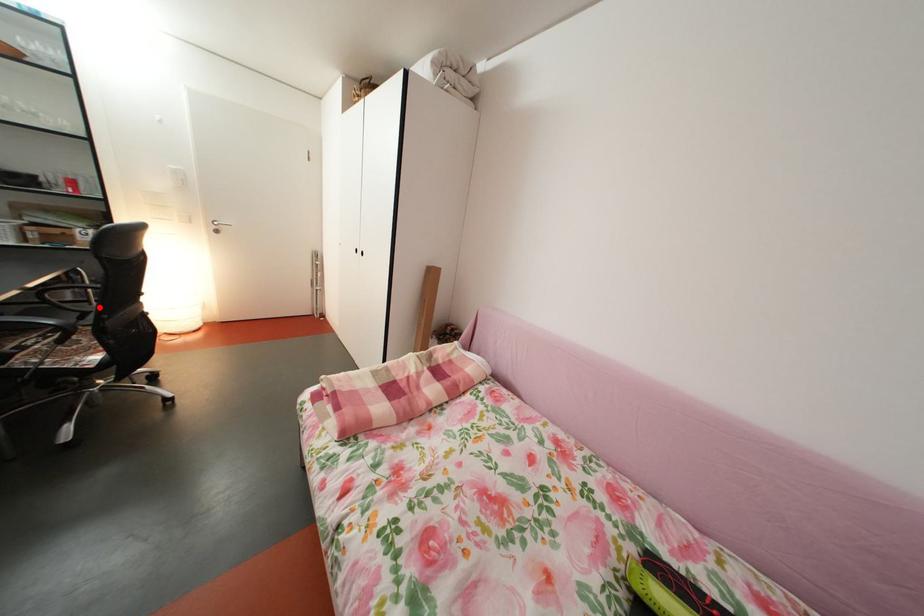
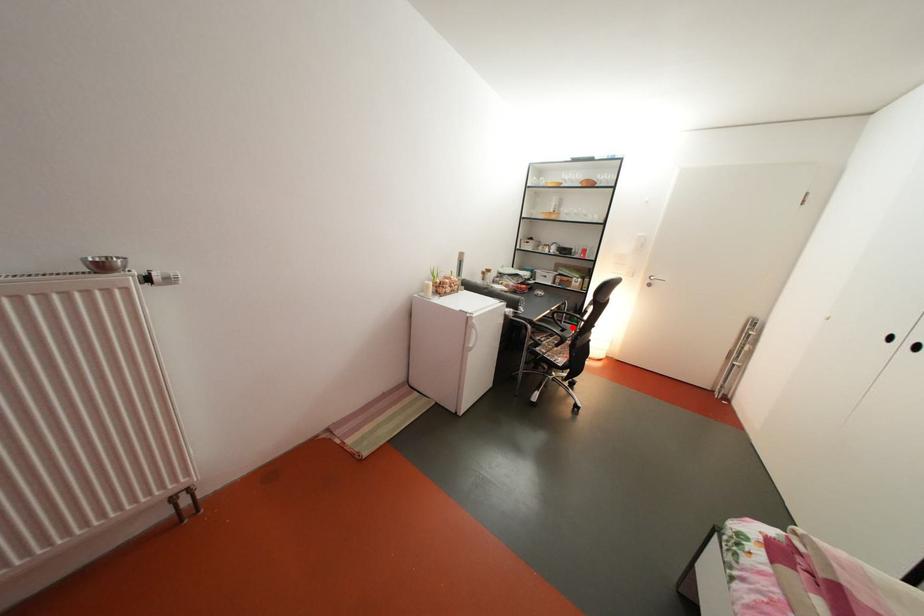
I am providing you with two images of the same scene from different viewpoints. A red point is marked on the first image and another point is marked on the second image. Is the red point in image1 aligned with the point shown in image2?

Yes